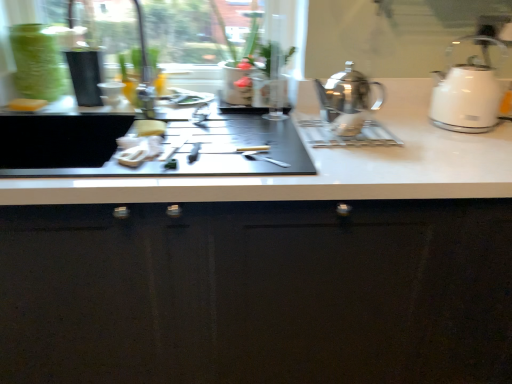
Question: Is point (159, 137) positioned closer to the camera than point (488, 336)?

Choices:
 (A) farther
 (B) closer

Answer: (B)

Question: Is white fabric napkin at center, marked as the 1th food in a bottom-to-top arrangement, inside the boundaries of glossy black cabinet at center, or outside?

Choices:
 (A) outside
 (B) inside

Answer: (A)

Question: Based on their relative distances, which object is nearer to the white matte sponge at left, which is the third food from bottom to top?

Choices:
 (A) white fabric napkin at center, arranged as the third food when viewed from the top
 (B) white glossy kettle at right, which is the second kettle in left-to-right order
 (C) shiny metallic kettle at center, the second kettle when ordered from right to left
 (D) glossy black cabinet at center
 (E) yellow sponge at center, arranged as the 2th food when viewed from the top

Answer: (E)

Question: Which object is the farthest from the white fabric napkin at center, the 1th food from the front?

Choices:
 (A) green matte plant at center
 (B) yellow sponge at center, acting as the 2th food starting from the bottom
 (C) shiny metallic kettle at center, which appears as the first kettle when viewed from the left
 (D) white glossy kettle at right, acting as the 1th kettle starting from the right
 (E) white matte sponge at left, which is the third food from bottom to top

Answer: (D)